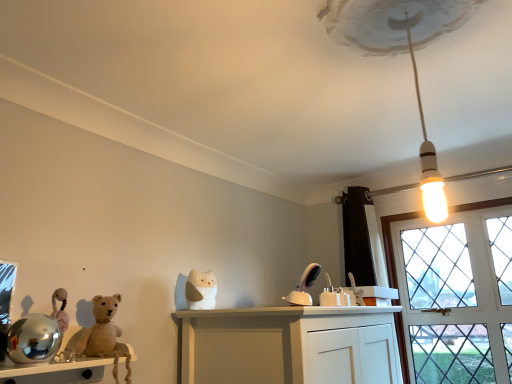
Consider the image. What is the approximate height of fuzzy beige teddy bear at left?

fuzzy beige teddy bear at left is 11.98 inches in height.

Locate an element on the screen. white glossy bulb at upper center is located at coordinates (401, 52).

Image resolution: width=512 pixels, height=384 pixels. What do you see at coordinates (201, 290) in the screenshot? I see `white matte cat at center` at bounding box center [201, 290].

Find the location of `clear glass window at right`. clear glass window at right is located at coordinates (392, 242).

Is point (390, 3) positioned before point (194, 281)?

Yes, point (390, 3) is closer to viewer.

Can you confirm if white glossy bulb at upper center is positioned to the left of white matte cat at center?

No, white glossy bulb at upper center is not to the left of white matte cat at center.

From a real-world perspective, is white glossy bulb at upper center over white matte cat at center?

Yes, from a real-world perspective, white glossy bulb at upper center is on top of white matte cat at center.

Between white glossy bulb at upper center and white matte cat at center, which one has less height?

white matte cat at center is shorter.

Considering the positions of point (450, 211) and point (446, 0), is point (450, 211) closer or farther from the camera than point (446, 0)?

Point (450, 211) is positioned farther from the camera compared to point (446, 0).

Considering the sizes of objects clear glass window at right and white glossy bulb at upper center in the image provided, who is taller, clear glass window at right or white glossy bulb at upper center?

With more height is clear glass window at right.

Is the position of clear glass window at right less distant than that of white glossy bulb at upper center?

No, clear glass window at right is further to the viewer.

Is clear glass window at right to the left or to the right of white glossy bulb at upper center in the image?

Clearly, clear glass window at right is on the right of white glossy bulb at upper center in the image.

Is wooden shelf at lower left further to the viewer compared to white matte cat at center?

No, it is not.

Is wooden shelf at lower left in contact with white matte cat at center?

No, wooden shelf at lower left is not in contact with white matte cat at center.

Can you tell me how much wooden shelf at lower left and white matte cat at center differ in facing direction?

They differ by 1.31 degrees in their facing directions.

Locate an element on the screen. This screenshot has height=384, width=512. table that is below the white matte cat at center (from the image's perspective) is located at coordinates [x=56, y=372].

Is white matte cat at center thinner than wooden shelf at lower left?

Correct, the width of white matte cat at center is less than that of wooden shelf at lower left.

Is white matte cat at center directly adjacent to wooden shelf at lower left?

No, white matte cat at center is not with wooden shelf at lower left.

Looking at this image, considering the relative sizes of wooden shelf at lower left and fuzzy beige teddy bear at left in the image provided, is wooden shelf at lower left wider than fuzzy beige teddy bear at left?

Yes, wooden shelf at lower left is wider than fuzzy beige teddy bear at left.

Considering the relative sizes of wooden shelf at lower left and fuzzy beige teddy bear at left in the image provided, is wooden shelf at lower left shorter than fuzzy beige teddy bear at left?

Indeed, wooden shelf at lower left has a lesser height compared to fuzzy beige teddy bear at left.

Are wooden shelf at lower left and fuzzy beige teddy bear at left making contact?

Yes, wooden shelf at lower left is beside fuzzy beige teddy bear at left.

From the image's perspective, is wooden shelf at lower left under fuzzy beige teddy bear at left?

Yes.

Is clear glass window at right not near fuzzy beige teddy bear at left?

Yes, clear glass window at right and fuzzy beige teddy bear at left are quite far apart.

From the image's perspective, who appears lower, clear glass window at right or fuzzy beige teddy bear at left?

clear glass window at right is shown below in the image.

Is fuzzy beige teddy bear at left inside clear glass window at right?

No.

Does point (406, 371) appear closer or farther from the camera than point (81, 336)?

Clearly, point (406, 371) is more distant from the camera than point (81, 336).

Does point (132, 350) appear closer or farther from the camera than point (433, 221)?

Point (132, 350) is positioned closer to the camera compared to point (433, 221).

Is white glossy bulb at upper center located within wooden shelf at lower left?

No.

Looking at this image, is wooden shelf at lower left bigger than white glossy bulb at upper center?

Actually, wooden shelf at lower left might be smaller than white glossy bulb at upper center.

From a real-world perspective, is wooden shelf at lower left positioned under white glossy bulb at upper center based on gravity?

Yes, from a real-world perspective, wooden shelf at lower left is beneath white glossy bulb at upper center.

I want to click on lamp that is in front of the white matte cat at center, so click(401, 52).

Find the location of a particular element. lamp lying above the clear glass window at right (from the image's perspective) is located at coordinates (401, 52).

Considering their positions, is fuzzy beige teddy bear at left positioned closer to clear glass window at right than white matte cat at center?

white matte cat at center is closer to clear glass window at right.

Looking at the image, which one is located further to white glossy bulb at upper center, white matte cat at center or clear glass window at right?

Among the two, clear glass window at right is located further to white glossy bulb at upper center.

Estimate the real-world distances between objects in this image. Which object is closer to fuzzy beige teddy bear at left, white matte cat at center or clear glass window at right?

white matte cat at center.

From the image, which object appears to be farther from white matte cat at center, clear glass window at right or white glossy bulb at upper center?

clear glass window at right is positioned further to the anchor white matte cat at center.

Considering their positions, is fuzzy beige teddy bear at left positioned closer to white matte cat at center than white glossy bulb at upper center?

fuzzy beige teddy bear at left is positioned closer to the anchor white matte cat at center.

From the image, which object appears to be nearer to clear glass window at right, white glossy bulb at upper center or wooden shelf at lower left?

white glossy bulb at upper center is closer to clear glass window at right.

Considering their positions, is wooden shelf at lower left positioned further to white matte cat at center than fuzzy beige teddy bear at left?

wooden shelf at lower left.

Based on their spatial positions, is clear glass window at right or wooden shelf at lower left further from fuzzy beige teddy bear at left?

clear glass window at right.

Locate an element on the screen. The image size is (512, 384). animal between wooden shelf at lower left and white matte cat at center in the front-back direction is located at coordinates (105, 335).

Identify the location of animal between wooden shelf at lower left and clear glass window at right. The width and height of the screenshot is (512, 384). (105, 335).

I want to click on toy between wooden shelf at lower left and clear glass window at right, so click(x=201, y=290).

At what (x,y) coordinates should I click in order to perform the action: click on lamp between wooden shelf at lower left and clear glass window at right in the horizontal direction. Please return your answer as a coordinate pair (x, y). Image resolution: width=512 pixels, height=384 pixels. Looking at the image, I should click on (401, 52).